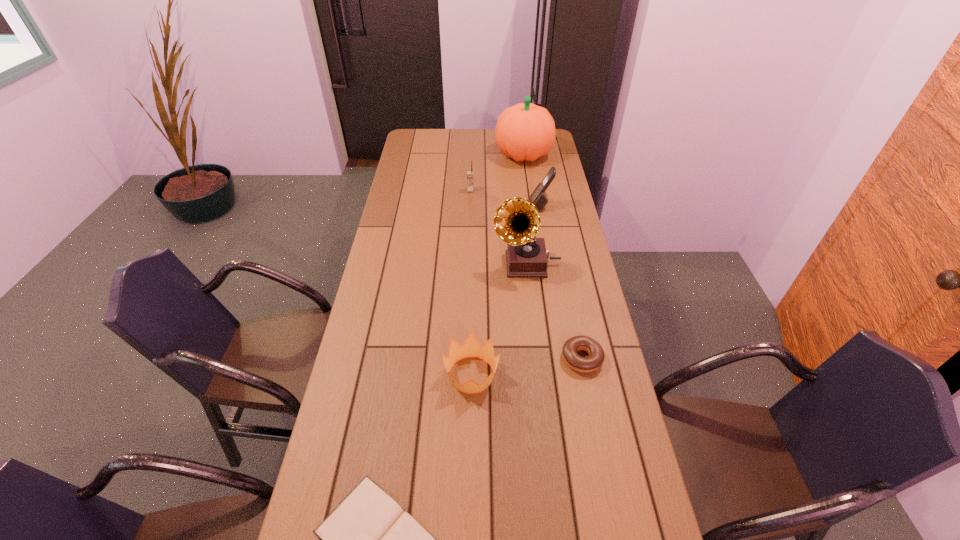
This screenshot has width=960, height=540. Find the location of `phonograph record that is positioned at the right edge`. phonograph record that is positioned at the right edge is located at coordinates (517, 221).

This screenshot has width=960, height=540. Identify the location of cellular telephone that is positioned at the right edge. (539, 198).

This screenshot has width=960, height=540. I want to click on doughnut that is at the right edge, so click(596, 356).

Where is `object located in the far right corner section of the desktop`? The height and width of the screenshot is (540, 960). object located in the far right corner section of the desktop is located at coordinates (524, 132).

The height and width of the screenshot is (540, 960). I want to click on vacant area at the left edge of the desktop, so click(391, 202).

Locate an element on the screen. This screenshot has width=960, height=540. free space at the right edge of the desktop is located at coordinates (589, 323).

The image size is (960, 540). I want to click on free space between the fifth nearest object and the pumpkin, so tap(532, 181).

Find the location of `empty space that is in between the nearer cellular telephone and the fifth tallest object`. empty space that is in between the nearer cellular telephone and the fifth tallest object is located at coordinates (506, 291).

Identify the location of unoccupied area between the farthest object and the doughnut. (553, 256).

Locate an element on the screen. The height and width of the screenshot is (540, 960). free spot between the phonograph record and the sixth tallest object is located at coordinates (554, 311).